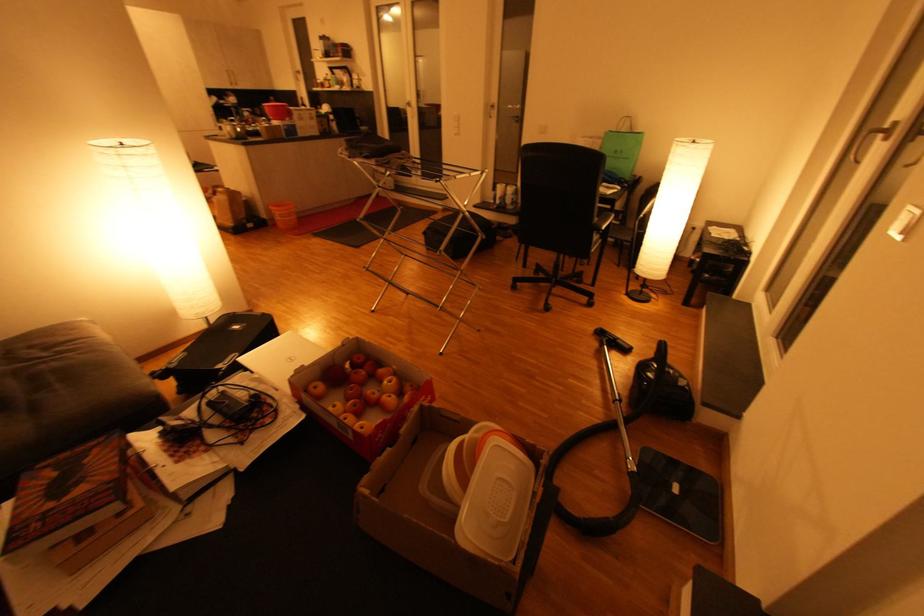
The location [284,215] corresponds to which object?

It refers to a orange bucket.